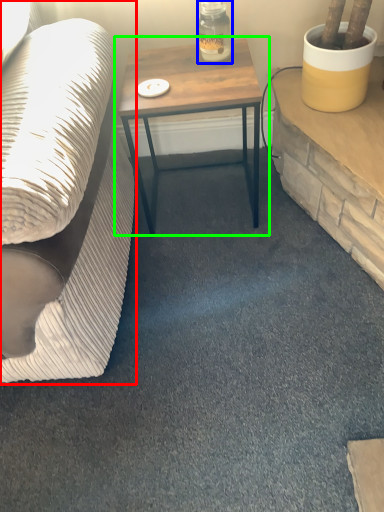
Question: Which object is positioned farthest from studio couch (highlighted by a red box)? Select from bottle (highlighted by a blue box) and table (highlighted by a green box).

Choices:
 (A) bottle
 (B) table

Answer: (A)